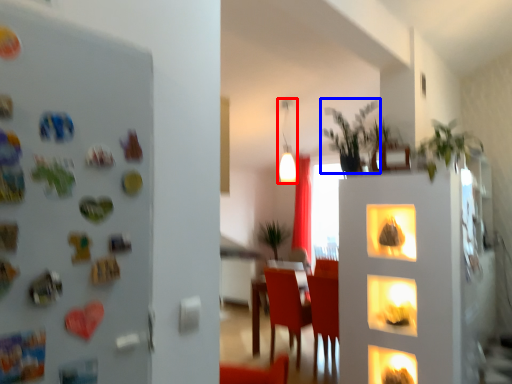
Question: Which point is closer to the camera, lamp (highlighted by a red box) or plant (highlighted by a blue box)?

Choices:
 (A) lamp
 (B) plant

Answer: (B)